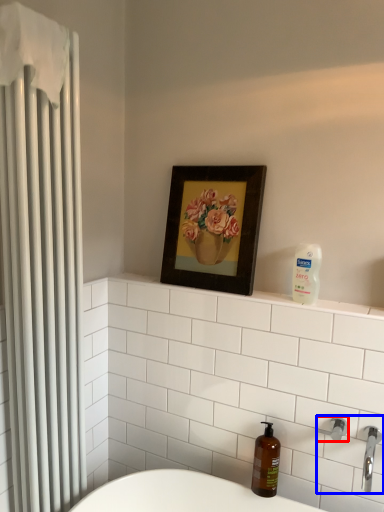
Question: Which object is closer to the camera taking this photo, shower (highlighted by a red box) or sink (highlighted by a blue box)?

Choices:
 (A) shower
 (B) sink

Answer: (B)